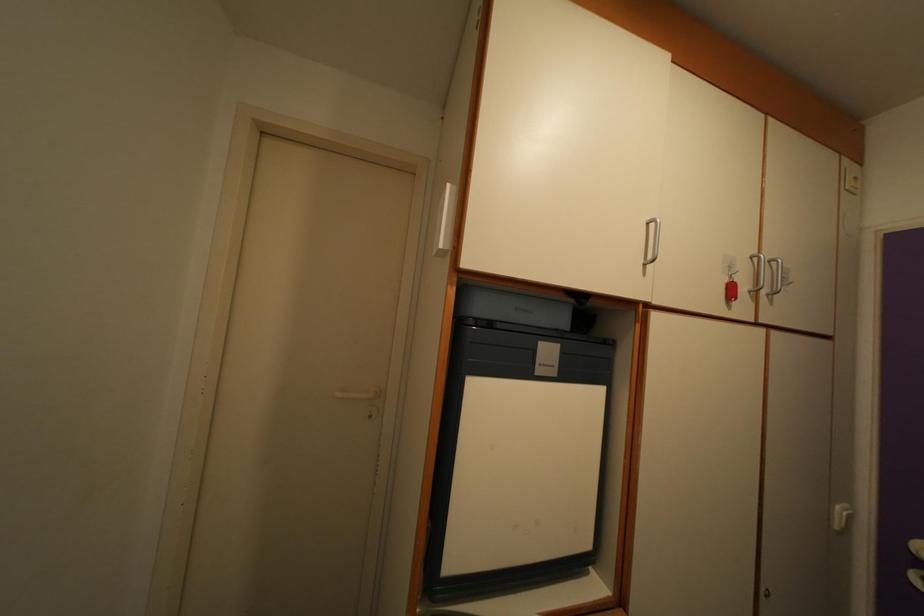
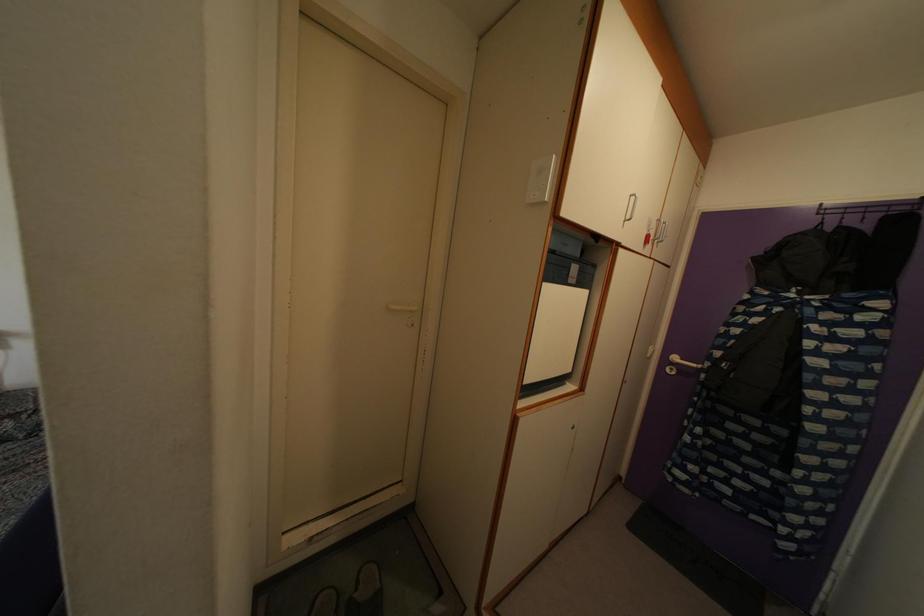
Where in the second image is the point corresponding to the point at 654,233 from the first image?

(636, 206)